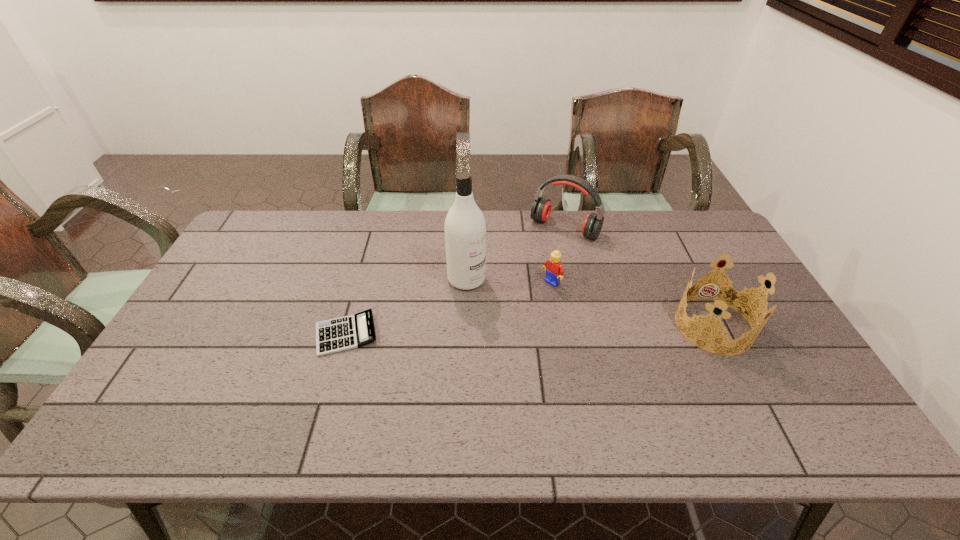
The image size is (960, 540). I want to click on vacant space located on the front-facing side of the shampoo, so click(x=554, y=354).

Locate an element on the screen. The image size is (960, 540). free region located on the front-facing side of the shampoo is located at coordinates (505, 312).

I want to click on vacant region located on the ear cups of the farthest object, so click(495, 314).

Where is `free point located on the ear cups of the farthest object`? This screenshot has width=960, height=540. free point located on the ear cups of the farthest object is located at coordinates (496, 312).

The height and width of the screenshot is (540, 960). In order to click on vacant space situated on the ear cups of the farthest object in this screenshot , I will do `click(541, 254)`.

Where is `blank space located on the front-facing side of the Lego`? blank space located on the front-facing side of the Lego is located at coordinates (451, 361).

I want to click on free location located on the front-facing side of the Lego, so click(x=451, y=361).

What are the coordinates of `free space located on the front-facing side of the Lego` in the screenshot? It's located at coord(530,300).

Where is `object at the far edge`? The image size is (960, 540). object at the far edge is located at coordinates (541, 208).

Locate an element on the screen. object that is at the right edge is located at coordinates pyautogui.click(x=729, y=298).